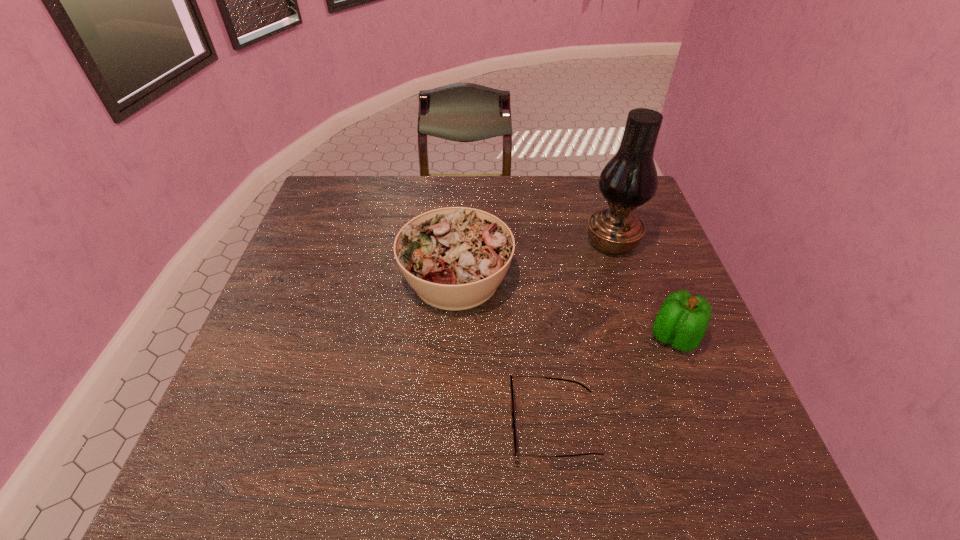
What are the coordinates of `free point located 0.070m on the face of the nearest object` in the screenshot? It's located at (475, 425).

What are the coordinates of `object present at the near edge` in the screenshot? It's located at (514, 446).

Locate an element on the screen. oil lamp at the right edge is located at coordinates (629, 179).

This screenshot has height=540, width=960. Find the location of `bell pepper situated at the right edge`. bell pepper situated at the right edge is located at coordinates (682, 321).

You are a GUI agent. You are given a task and a screenshot of the screen. Output one action in this format:
    pyautogui.click(x=<x>, y=<y>)
    Task: Click on the vacant space at the far edge
    
    Given the screenshot: What is the action you would take?
    pyautogui.click(x=484, y=208)

The image size is (960, 540). In the image, there is a desktop. In order to click on free space at the near edge in this screenshot , I will do `click(482, 450)`.

You are a GUI agent. You are given a task and a screenshot of the screen. Output one action in this format:
    pyautogui.click(x=<x>, y=<y>)
    Task: Click on the free space at the left edge
    This screenshot has height=540, width=960.
    Given the screenshot: What is the action you would take?
    pyautogui.click(x=259, y=347)

In order to click on free space at the right edge in this screenshot , I will do `click(655, 384)`.

Identify the location of vacant space at the near left corner of the desktop. The image size is (960, 540). (228, 461).

In order to click on free space at the far right corner of the desktop in this screenshot , I will do `click(590, 185)`.